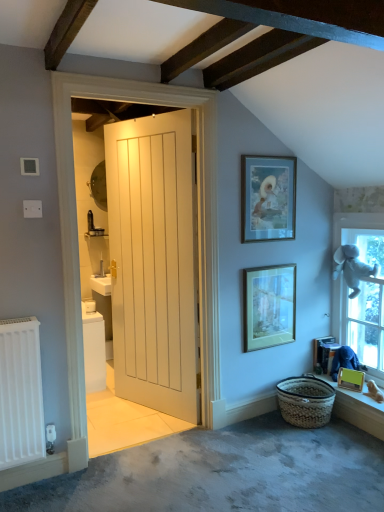
This screenshot has height=512, width=384. In order to click on free location in front of matte yellow picture frame at lower right, acting as the 3th picture frame starting from the left in this screenshot , I will do `click(357, 399)`.